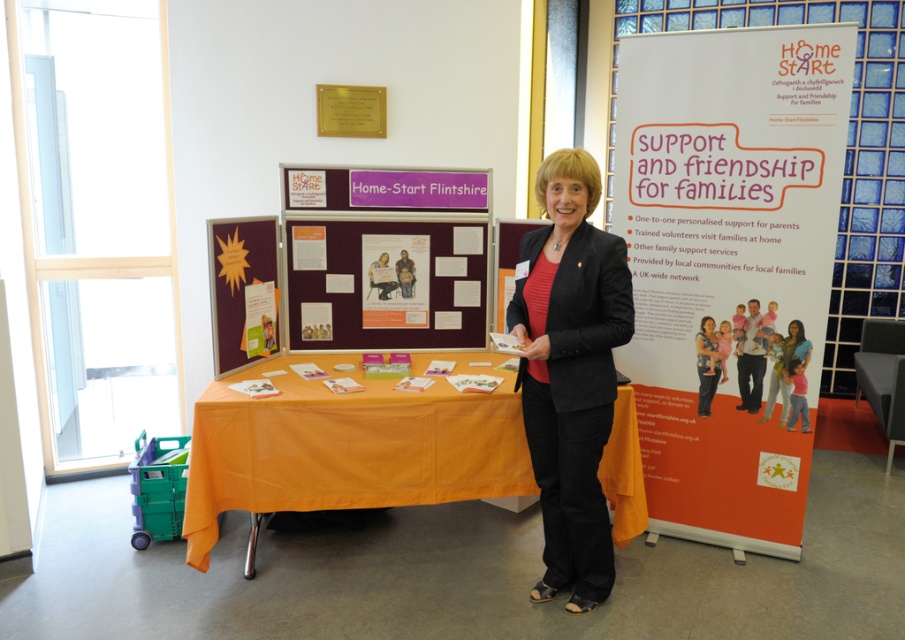
Question: Which object appears farthest from the camera in this image?

Choices:
 (A) matte paper poster at center
 (B) matte black blazer at center

Answer: (A)

Question: Which object is the closest to the matte paper poster at center?

Choices:
 (A) matte black blazer at center
 (B) orange fabric table at center
 (C) orange paper at right
 (D) maroon fabric poster at center

Answer: (D)

Question: Does orange fabric table at center have a lesser width compared to maroon fabric poster at center?

Choices:
 (A) no
 (B) yes

Answer: (A)

Question: Which of these objects is positioned closest to the matte paper poster at center?

Choices:
 (A) matte black blazer at center
 (B) maroon fabric poster at center
 (C) orange paper at right

Answer: (B)

Question: Is the position of maroon fabric poster at center more distant than that of matte paper poster at center?

Choices:
 (A) no
 (B) yes

Answer: (A)

Question: Does matte black blazer at center have a lesser width compared to maroon fabric poster at center?

Choices:
 (A) yes
 (B) no

Answer: (A)